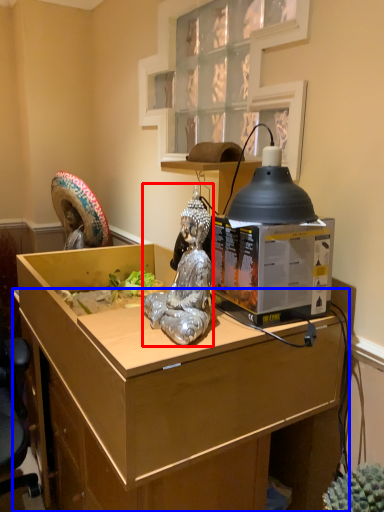
Question: Which of the following is the closest to the observer, person (highlighted by a red box) or desk (highlighted by a blue box)?

Choices:
 (A) person
 (B) desk

Answer: (B)